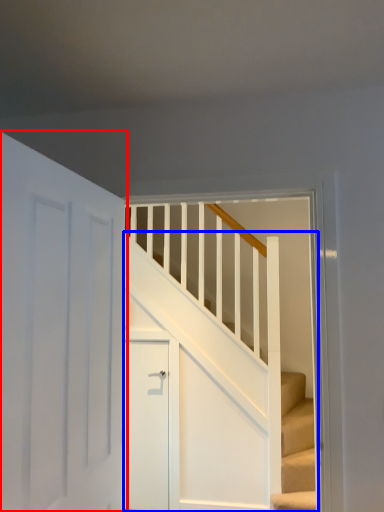
Question: Which of the following is the closest to the observer, door (highlighted by a red box) or stairs (highlighted by a blue box)?

Choices:
 (A) door
 (B) stairs

Answer: (A)